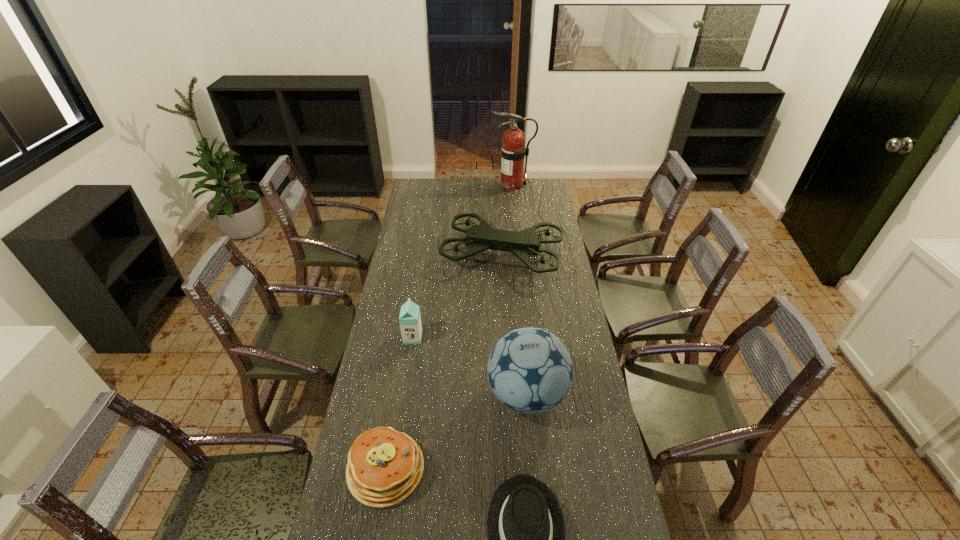
Locate an element on the screen. Image resolution: width=960 pixels, height=540 pixels. vacant space that is in between the tallest object and the milk carton is located at coordinates (463, 261).

Locate an element on the screen. vacant space in between the tallest object and the drone is located at coordinates (507, 220).

Image resolution: width=960 pixels, height=540 pixels. In order to click on vacant space in between the drone and the pancake in this screenshot , I will do `click(444, 362)`.

This screenshot has width=960, height=540. Identify the location of vacant area that lies between the fourth nearest object and the drone. (458, 296).

This screenshot has height=540, width=960. Identify the location of empty space that is in between the drone and the soccer ball. (515, 325).

Find the location of `object that is the third closest one to the third nearest object`. object that is the third closest one to the third nearest object is located at coordinates pos(410,319).

Locate which object ranks fifth in proximity to the farthest object. Please provide its 2D coordinates. Your answer should be formatted as a tuple, i.e. [(x, y)], where the tuple contains the x and y coordinates of a point satisfying the conditions above.

[(526, 531)]

Locate an element on the screen. This screenshot has height=540, width=960. free space that satisfies the following two spatial constraints: 1. on the side with brand of the soccer ball; 2. on the front side of the pancake is located at coordinates (534, 469).